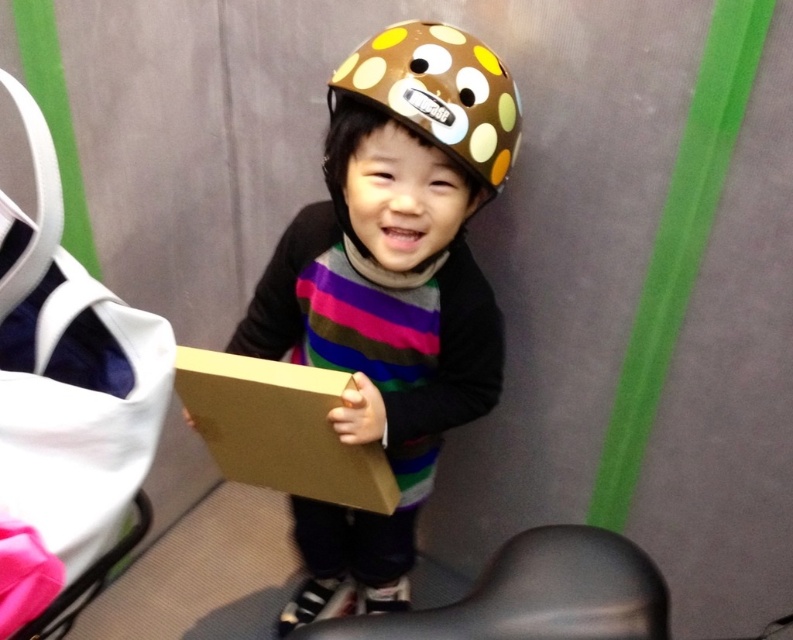
Question: Which object appears farthest from the camera in this image?

Choices:
 (A) brown cardboard box at center
 (B) brown dotted helmet at center
 (C) brown matte helmet at center

Answer: (C)

Question: Does brown dotted helmet at center lie behind brown cardboard box at center?

Choices:
 (A) yes
 (B) no

Answer: (A)

Question: Can you confirm if brown matte helmet at center is smaller than brown dotted helmet at center?

Choices:
 (A) no
 (B) yes

Answer: (A)

Question: Considering the real-world distances, which object is closest to the brown cardboard box at center?

Choices:
 (A) brown dotted helmet at center
 (B) brown matte helmet at center

Answer: (B)

Question: Among these objects, which one is farthest from the camera?

Choices:
 (A) brown cardboard box at center
 (B) brown matte helmet at center

Answer: (B)

Question: Does brown matte helmet at center appear over brown dotted helmet at center?

Choices:
 (A) yes
 (B) no

Answer: (B)